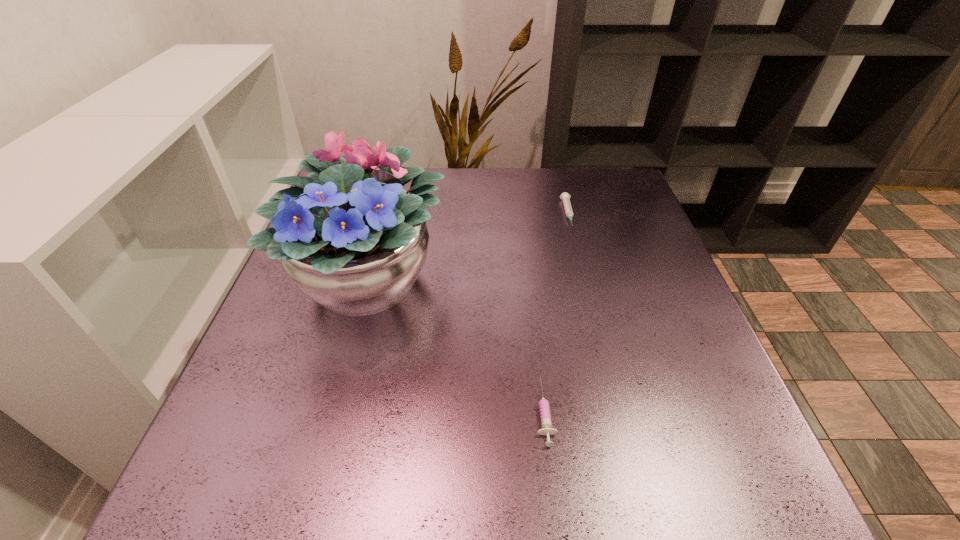
This screenshot has height=540, width=960. Find the location of `object located in the left edge section of the desktop`. object located in the left edge section of the desktop is located at coordinates (348, 236).

You are a GUI agent. You are given a task and a screenshot of the screen. Output one action in this format:
    pyautogui.click(x=<x>, y=<y>)
    Task: Click on the vacant space at the far edge of the desktop
    Image resolution: width=960 pixels, height=540 pixels.
    Given the screenshot: What is the action you would take?
    pyautogui.click(x=577, y=212)

At what (x,y) coordinates should I click in order to perform the action: click on blank area at the near edge. Please return your answer as a coordinate pair (x, y). Image resolution: width=960 pixels, height=540 pixels. Looking at the image, I should click on (410, 493).

Where is `vacant space at the left edge of the desktop`? The image size is (960, 540). vacant space at the left edge of the desktop is located at coordinates click(x=253, y=388).

This screenshot has height=540, width=960. In the image, there is a desktop. Find the location of `vacant area at the right edge`. vacant area at the right edge is located at coordinates (684, 314).

This screenshot has height=540, width=960. Identify the location of free region at the near left corner of the desktop. (213, 515).

This screenshot has width=960, height=540. I want to click on vacant space at the far right corner, so click(604, 171).

Where is `vacant region between the nearest object and the rightmost object`? Image resolution: width=960 pixels, height=540 pixels. vacant region between the nearest object and the rightmost object is located at coordinates (556, 313).

Locate an element on the screen. This screenshot has height=540, width=960. empty space between the nearer syringe and the bouquet is located at coordinates (458, 346).

Identify the location of vacant area that lies between the left syringe and the rightmost object. This screenshot has width=960, height=540. (556, 313).